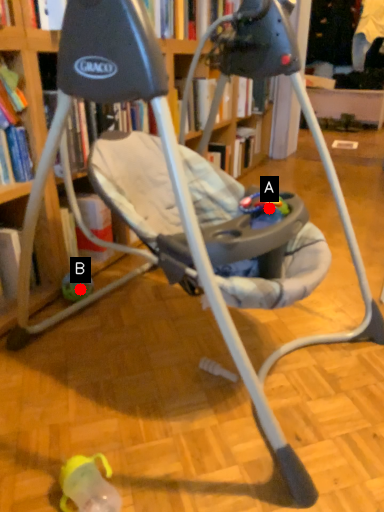
Question: Two points are circled on the image, labeled by A and B beside each circle. Which point is closer to the camera?

Choices:
 (A) A is closer
 (B) B is closer

Answer: (A)